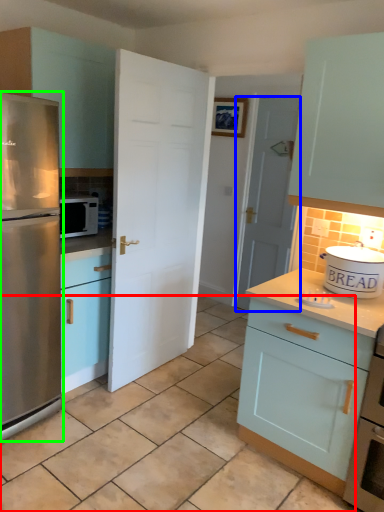
Question: Which is farther away from tile (highlighted by a red box)? door (highlighted by a blue box) or refrigerator (highlighted by a green box)?

Choices:
 (A) door
 (B) refrigerator

Answer: (A)